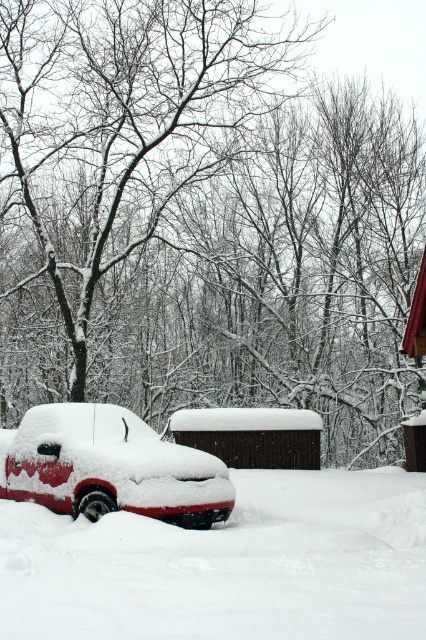
Question: Which of the following is the farthest from the observer?

Choices:
 (A) snow-covered tree at center
 (B) brown wooden cabin at center

Answer: (B)

Question: Where is snow-covered red truck at lower left located in relation to brown wooden cabin at center in the image?

Choices:
 (A) right
 (B) left

Answer: (B)

Question: Which point is farther to the camera?

Choices:
 (A) brown wooden cabin at center
 (B) white fluffy snow at lower center
 (C) snow-covered tree at center
 (D) snow-covered red truck at lower left

Answer: (A)

Question: Is white fluffy snow at lower center wider than brown wooden cabin at center?

Choices:
 (A) yes
 (B) no

Answer: (B)

Question: Which of the following is the closest to the observer?

Choices:
 (A) snow-covered red truck at lower left
 (B) brown wooden cabin at center
 (C) snow-covered tree at center

Answer: (A)

Question: Does white fluffy snow at lower center have a greater width compared to snow-covered red truck at lower left?

Choices:
 (A) yes
 (B) no

Answer: (B)